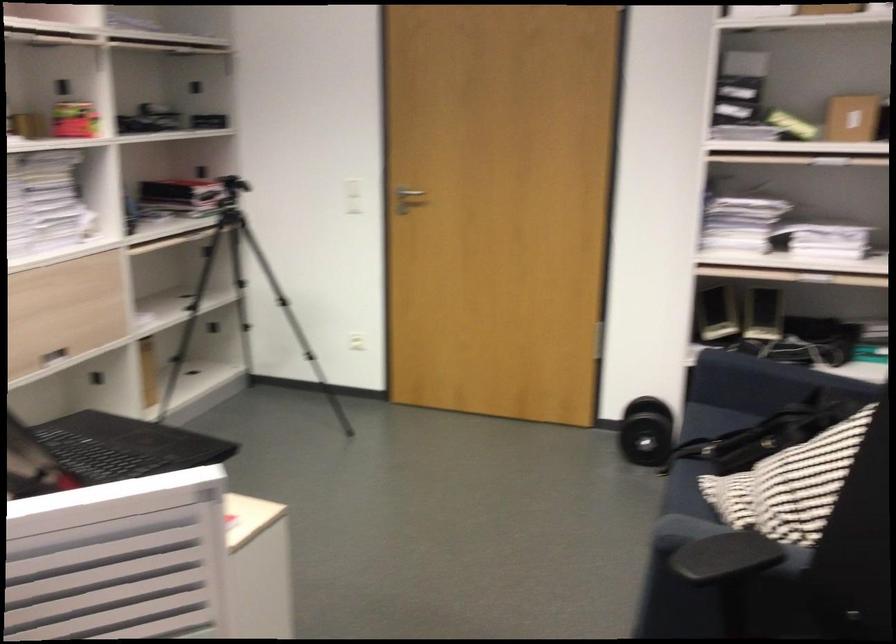
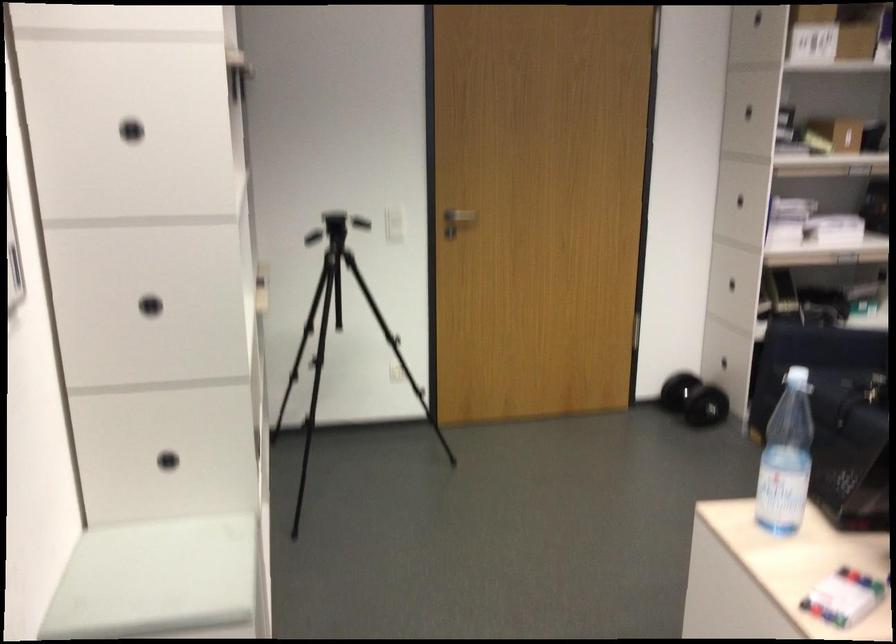
The point at (440, 192) is marked in the first image. Where is the corresponding point in the second image?

(460, 216)